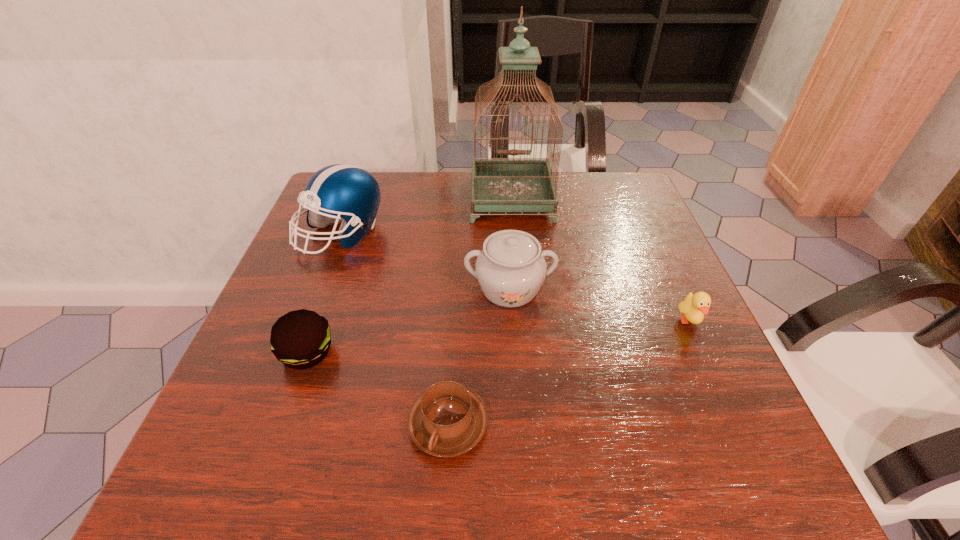
The height and width of the screenshot is (540, 960). Identify the location of free region at the near edge. (651, 445).

Locate an element on the screen. The height and width of the screenshot is (540, 960). vacant region at the left edge is located at coordinates (253, 335).

The image size is (960, 540). I want to click on vacant space at the right edge of the desktop, so click(x=653, y=245).

This screenshot has width=960, height=540. In the image, there is a desktop. Find the location of `free region at the far right corner`. free region at the far right corner is located at coordinates (602, 213).

The image size is (960, 540). I want to click on empty location between the shortest object and the rightmost object, so click(x=569, y=373).

You are a GUI agent. You are given a task and a screenshot of the screen. Output one action in this format:
    pyautogui.click(x=<x>, y=<y>)
    Task: Click on the vacant region between the chinaware and the patty
    This screenshot has width=960, height=540.
    Given the screenshot: What is the action you would take?
    pyautogui.click(x=408, y=321)

Locate an element on the screen. The image size is (960, 540). vacant region between the chinaware and the shortest object is located at coordinates (479, 356).

The width and height of the screenshot is (960, 540). I want to click on empty space between the chinaware and the cappuccino, so click(479, 356).

At what (x,y) coordinates should I click in order to perform the action: click on free point between the patty and the birdcage. Please return your answer as a coordinate pair (x, y). This screenshot has height=540, width=960. Looking at the image, I should click on (409, 276).

Identify the location of empty space that is in between the tallest object and the duckling. Image resolution: width=960 pixels, height=540 pixels. (600, 260).